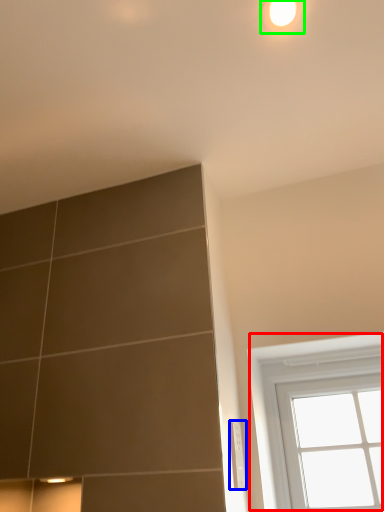
Question: Estimate the real-world distances between objects in this image. Which object is closer to window (highlighted by a red box), electric outlet (highlighted by a blue box) or light (highlighted by a green box)?

Choices:
 (A) electric outlet
 (B) light

Answer: (A)